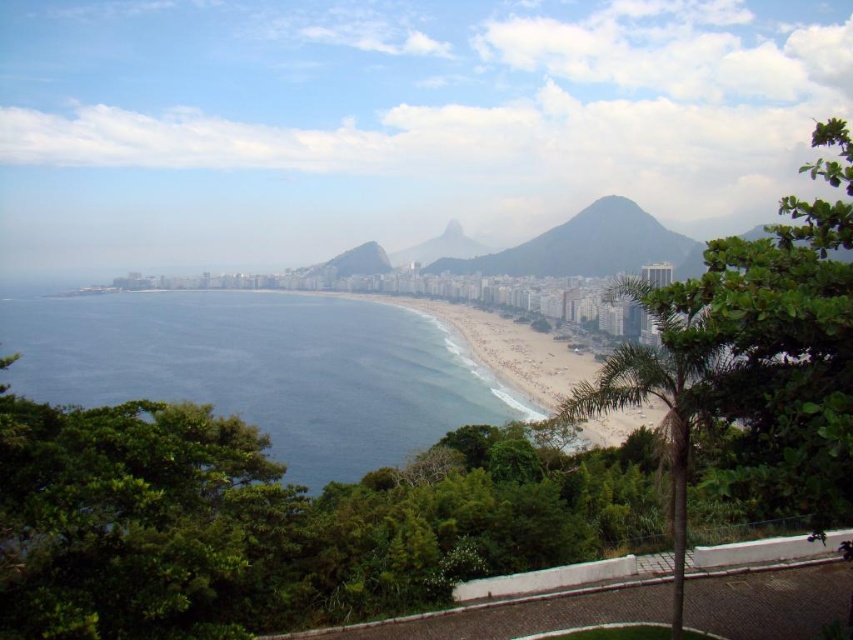
You are standing at the viewpoint and see two points marked in the image. According to their positions, which point is closer to you, point at (120,321) or point at (621,252)?

Point at (621,252) is closer to you because the description states that point at (120,321) is behind point at (621,252).

You are standing at the viewpoint overlooking the coastal cityscape. You want to estimate how far the blue water at center is from your current position. Based on the scene, can you determine the distance?

The blue water at center is 240.60 meters away from the camera, so the distance from your current position to the blue water at center is approximately 240.60 meters.

You are a drone operator tasked with capturing aerial footage of the coastal cityscape. Your drone has a maximum flight range of 200 meters from its starting position. If you launch the drone from the beach area, can it safely fly between the blue water at center and the green textured mountain at center without exceeding its range?

The distance between the blue water at center and the green textured mountain at center is 202.11 meters, which exceeds the drone operator maximum flight range of 200 meters. Therefore, the drone cannot safely fly between them without exceeding its range.